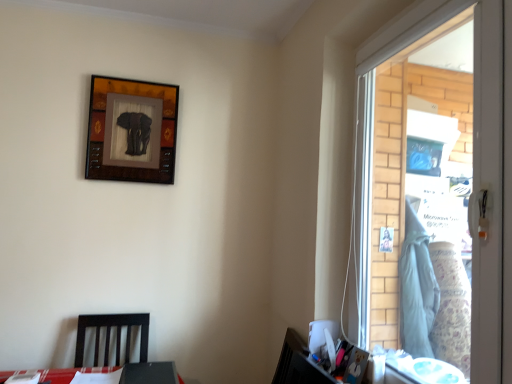
Question: Does clear glass window at right have a greater height compared to dark wood chair at lower left?

Choices:
 (A) no
 (B) yes

Answer: (B)

Question: From a real-world perspective, is clear glass window at right positioned over dark wood chair at lower left based on gravity?

Choices:
 (A) no
 (B) yes

Answer: (B)

Question: Is clear glass window at right not within dark wood chair at lower left?

Choices:
 (A) no
 (B) yes

Answer: (B)

Question: Is clear glass window at right far away from dark wood chair at lower left?

Choices:
 (A) no
 (B) yes

Answer: (B)

Question: Could you tell me if clear glass window at right is turned towards dark wood chair at lower left?

Choices:
 (A) yes
 (B) no

Answer: (B)

Question: Is clear glass window at right facing away from dark wood chair at lower left?

Choices:
 (A) yes
 (B) no

Answer: (B)

Question: Is clear glass window at right not close to wooden elephant art at upper left?

Choices:
 (A) no
 (B) yes

Answer: (B)

Question: From a real-world perspective, is clear glass window at right on top of wooden elephant art at upper left?

Choices:
 (A) yes
 (B) no

Answer: (B)

Question: Is clear glass window at right smaller than wooden elephant art at upper left?

Choices:
 (A) yes
 (B) no

Answer: (B)

Question: From the image's perspective, is clear glass window at right below wooden elephant art at upper left?

Choices:
 (A) yes
 (B) no

Answer: (A)

Question: Would you say clear glass window at right contains wooden elephant art at upper left?

Choices:
 (A) yes
 (B) no

Answer: (B)

Question: Does clear glass window at right have a lesser width compared to wooden elephant art at upper left?

Choices:
 (A) yes
 (B) no

Answer: (B)

Question: Can you confirm if dark wood chair at lower left is bigger than wooden elephant art at upper left?

Choices:
 (A) yes
 (B) no

Answer: (A)